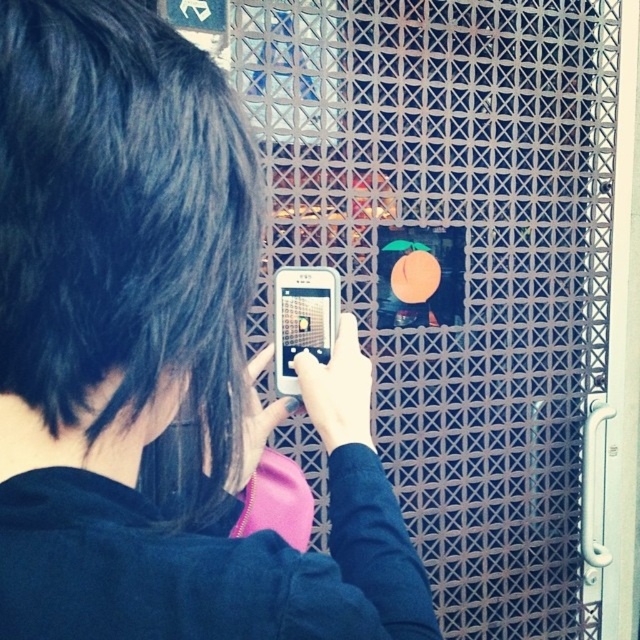
You are a photographer trying to capture a clear image of the colorful display through the metal grid. You notice two devices in your viewfinder, the black matte phone at center and the white matte smartphone at center. Which device is blocking the other from your view?

The black matte phone at center is blocking the white matte smartphone at center because it is positioned in front of it.

You are holding a black matte phone at center that is 13.97 inches from your camera. You want to take a clearer photo of the colorful display through the metal grid. What should you do?

The black matte phone at center is 13.97 inches from the camera. To take a clearer photo of the colorful display through the metal grid, move the black matte phone at center closer to the grid to reduce the distance between the camera and the grid.